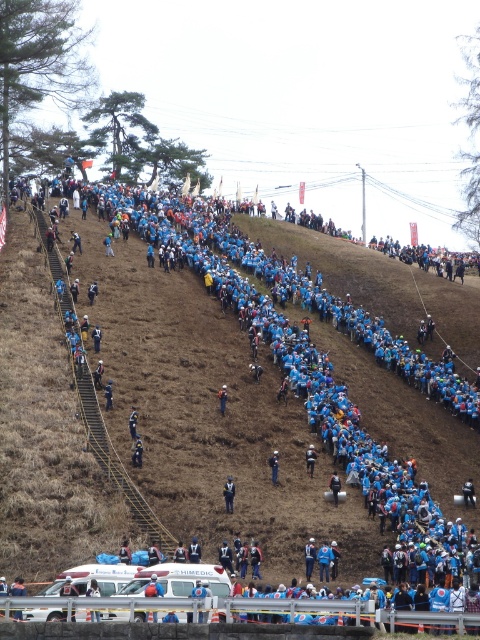
You are standing at the bottom of the hill and want to reach the top. There are two points marked on the hillside, point A at coordinates point (228, 504) and point B at coordinates point (220, 387). Which point is closer to you as you start climbing?

Point A at coordinates point (228, 504) is closer to the camera than point B at coordinates point (220, 387), so point A is closer to you as you start climbing.

Looking at this image, you are a photographer at the event and want to capture both the blue fabric person at upper center and the blue fabric jacket at center in the same frame. Given their sizes, which one should you focus on to ensure both are visible without zooming in or out?

The blue fabric jacket at center is smaller than the blue fabric person at upper center, so focusing on the blue fabric jacket at center would allow both to be visible in the frame without needing to adjust the zoom.

You are standing at the bottom of the hill and see a participant wearing a blue fabric jacket at center. If you want to reach the point marked at coordinates (228, 493), which direction should you move relative to the blue fabric jacket at center?

The point at coordinates (228, 493) is located on the blue fabric jacket at center, so you should move towards the blue fabric jacket at center to reach that point.